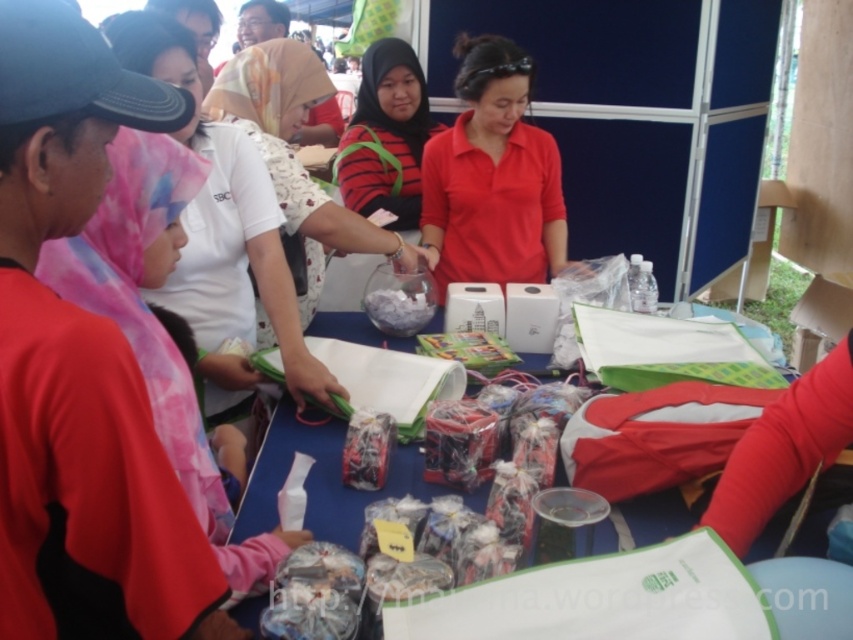
Question: Is blue fabric table at center wider than matte plastic candy at center?

Choices:
 (A) no
 (B) yes

Answer: (B)

Question: Which point is closer to the camera?

Choices:
 (A) matte red shirt at center
 (B) shiny metallic candy at center
 (C) translucent glass bowl at center

Answer: (B)

Question: Does pink fabric headscarf at left appear under matte red shirt at center?

Choices:
 (A) no
 (B) yes

Answer: (B)

Question: Is blue fabric table at center closer to the viewer compared to striped fabric at center?

Choices:
 (A) no
 (B) yes

Answer: (B)

Question: Which object is farther from the camera taking this photo?

Choices:
 (A) matte plastic candy at center
 (B) translucent glass bowl at center
 (C) matte red shirt at center

Answer: (C)

Question: Based on their relative distances, which object is farther from the striped fabric at center?

Choices:
 (A) blue fabric table at center
 (B) translucent glass bowl at center

Answer: (A)